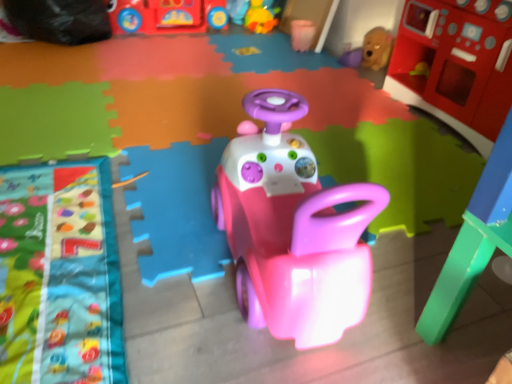
Locate an element on the screen. rubberized red play kitchen at upper right, marked as the 1th toy in a right-to-left arrangement is located at coordinates (456, 64).

At what (x,y) coordinates should I click in order to perform the action: click on shiny plastic bus at upper center, which is counted as the sixth toy, starting from the right. Please return your answer as a coordinate pair (x, y). The width and height of the screenshot is (512, 384). Looking at the image, I should click on (166, 16).

How much space does rubber duck at upper center, which appears as the second toy when viewed from the left, occupy horizontally?

It is 10.28 inches.

Locate an element on the screen. This screenshot has height=384, width=512. rubberized red play kitchen at upper right, marked as the 1th toy in a right-to-left arrangement is located at coordinates (456, 64).

Is rubber duck at upper center, the fifth toy positioned from the right, beside matte brown teddy bear at upper right, which is counted as the fifth toy, starting from the left?

No, rubber duck at upper center, the fifth toy positioned from the right, is not next to matte brown teddy bear at upper right, which is counted as the fifth toy, starting from the left.

Considering the relative sizes of rubber duck at upper center, the fifth toy positioned from the right, and matte brown teddy bear at upper right, acting as the 2th toy starting from the right, in the image provided, is rubber duck at upper center, the fifth toy positioned from the right, taller than matte brown teddy bear at upper right, acting as the 2th toy starting from the right,?

Correct, rubber duck at upper center, the fifth toy positioned from the right, is much taller as matte brown teddy bear at upper right, acting as the 2th toy starting from the right.

Which is correct: rubber duck at upper center, the fifth toy positioned from the right, is inside matte brown teddy bear at upper right, which is counted as the fifth toy, starting from the left, or outside of it?

rubber duck at upper center, the fifth toy positioned from the right, lies outside matte brown teddy bear at upper right, which is counted as the fifth toy, starting from the left.

From a real-world perspective, is pink plastic car at center, the fourth toy viewed from the right, physically above shiny plastic bus at upper center, which is counted as the sixth toy, starting from the right?

Yes, from a real-world perspective, pink plastic car at center, the fourth toy viewed from the right, is above shiny plastic bus at upper center, which is counted as the sixth toy, starting from the right.

What's the angular difference between pink plastic car at center, the fourth toy viewed from the right, and shiny plastic bus at upper center, which is counted as the sixth toy, starting from the right,'s facing directions?

The facing directions of pink plastic car at center, the fourth toy viewed from the right, and shiny plastic bus at upper center, which is counted as the sixth toy, starting from the right, are 94 degrees apart.

Based on the photo, between pink plastic car at center, positioned as the third toy in left-to-right order, and shiny plastic bus at upper center, marked as the 1th toy in a left-to-right arrangement, which one has smaller size?

With smaller size is pink plastic car at center, positioned as the third toy in left-to-right order.

Is pink plastic car at center, the fourth toy viewed from the right, facing away from shiny plastic bus at upper center, marked as the 1th toy in a left-to-right arrangement?

No, shiny plastic bus at upper center, marked as the 1th toy in a left-to-right arrangement, is not at the back of pink plastic car at center, the fourth toy viewed from the right.

Would you say rubberized red play kitchen at upper right, marked as the sixth toy in a left-to-right arrangement, is inside or outside rubber duck at upper center, the fifth toy positioned from the right?

rubberized red play kitchen at upper right, marked as the sixth toy in a left-to-right arrangement, is located beyond the bounds of rubber duck at upper center, the fifth toy positioned from the right.

Does rubberized red play kitchen at upper right, marked as the sixth toy in a left-to-right arrangement, have a smaller size compared to rubber duck at upper center, the fifth toy positioned from the right?

Actually, rubberized red play kitchen at upper right, marked as the sixth toy in a left-to-right arrangement, might be larger than rubber duck at upper center, the fifth toy positioned from the right.

From a real-world perspective, is rubberized red play kitchen at upper right, marked as the 1th toy in a right-to-left arrangement, above or below rubber duck at upper center, the fifth toy positioned from the right?

From a real-world perspective, rubberized red play kitchen at upper right, marked as the 1th toy in a right-to-left arrangement, is physically above rubber duck at upper center, the fifth toy positioned from the right.

Considering the sizes of objects rubberized red play kitchen at upper right, marked as the sixth toy in a left-to-right arrangement, and rubber duck at upper center, which appears as the second toy when viewed from the left, in the image provided, who is wider, rubberized red play kitchen at upper right, marked as the sixth toy in a left-to-right arrangement, or rubber duck at upper center, which appears as the second toy when viewed from the left,?

With larger width is rubberized red play kitchen at upper right, marked as the sixth toy in a left-to-right arrangement.

Between rubber duck at upper center, which appears as the second toy when viewed from the left, and shiny plastic bus at upper center, marked as the 1th toy in a left-to-right arrangement, which one appears on the right side from the viewer's perspective?

Positioned to the right is rubber duck at upper center, which appears as the second toy when viewed from the left.

Locate an element on the screen. The image size is (512, 384). the 1st toy in front of the rubber duck at upper center, the fifth toy positioned from the right, counting from the anchor's position is located at coordinates (166, 16).

Considering the sizes of objects rubber duck at upper center, which appears as the second toy when viewed from the left, and shiny plastic bus at upper center, marked as the 1th toy in a left-to-right arrangement, in the image provided, who is smaller, rubber duck at upper center, which appears as the second toy when viewed from the left, or shiny plastic bus at upper center, marked as the 1th toy in a left-to-right arrangement,?

rubber duck at upper center, which appears as the second toy when viewed from the left.

From a real-world perspective, is rubber duck at upper center, which appears as the second toy when viewed from the left, beneath shiny plastic bus at upper center, marked as the 1th toy in a left-to-right arrangement?

No.

From a real-world perspective, which is physically above, shiny plastic bus at upper center, which is counted as the sixth toy, starting from the right, or matte brown teddy bear at upper right, which is counted as the fifth toy, starting from the left?

In real-world perspective, shiny plastic bus at upper center, which is counted as the sixth toy, starting from the right, is above.

Does point (144, 9) appear closer or farther from the camera than point (369, 39)?

Point (144, 9) appears to be farther away from the viewer than point (369, 39).

Can you confirm if shiny plastic bus at upper center, marked as the 1th toy in a left-to-right arrangement, is positioned to the right of matte brown teddy bear at upper right, acting as the 2th toy starting from the right?

No.

Which of these two, shiny plastic bus at upper center, marked as the 1th toy in a left-to-right arrangement, or matte brown teddy bear at upper right, acting as the 2th toy starting from the right, stands shorter?

matte brown teddy bear at upper right, acting as the 2th toy starting from the right.

Is rubberized red play kitchen at upper right, marked as the sixth toy in a left-to-right arrangement, next to shiny plastic bus at upper center, which is counted as the sixth toy, starting from the right, and touching it?

There is a gap between rubberized red play kitchen at upper right, marked as the sixth toy in a left-to-right arrangement, and shiny plastic bus at upper center, which is counted as the sixth toy, starting from the right.

Can you confirm if rubberized red play kitchen at upper right, marked as the sixth toy in a left-to-right arrangement, is positioned to the left of shiny plastic bus at upper center, which is counted as the sixth toy, starting from the right?

Incorrect, rubberized red play kitchen at upper right, marked as the sixth toy in a left-to-right arrangement, is not on the left side of shiny plastic bus at upper center, which is counted as the sixth toy, starting from the right.

From the image's perspective, between rubberized red play kitchen at upper right, marked as the 1th toy in a right-to-left arrangement, and shiny plastic bus at upper center, which is counted as the sixth toy, starting from the right, which one is located above?

shiny plastic bus at upper center, which is counted as the sixth toy, starting from the right, from the image's perspective.

From a real-world perspective, does rubber duck at upper center, which appears as the second toy when viewed from the left, stand above pink plastic car at center, the fourth toy viewed from the right?

Actually, rubber duck at upper center, which appears as the second toy when viewed from the left, is physically below pink plastic car at center, the fourth toy viewed from the right, in the real world.

What are the coordinates of `the 5th toy in front of the rubber duck at upper center, the fifth toy positioned from the right, starting your count from the anchor` in the screenshot? It's located at (292, 229).

Does rubber duck at upper center, which appears as the second toy when viewed from the left, appear on the right side of pink plastic car at center, positioned as the third toy in left-to-right order?

No.

Locate an element on the screen. The width and height of the screenshot is (512, 384). the 3rd toy counting from the right side of the rubber duck at upper center, which appears as the second toy when viewed from the left is located at coordinates (376, 48).

This screenshot has height=384, width=512. Identify the location of the 5th toy below when counting from the shiny plastic bus at upper center, which is counted as the sixth toy, starting from the right (from the image's perspective). (292, 229).

Based on the photo, which object lies nearer to the anchor point shiny plastic bus at upper center, marked as the 1th toy in a left-to-right arrangement, rubberized red play kitchen at upper right, marked as the sixth toy in a left-to-right arrangement, or matte brown teddy bear at upper right, which is counted as the fifth toy, starting from the left?

matte brown teddy bear at upper right, which is counted as the fifth toy, starting from the left, is closer to shiny plastic bus at upper center, marked as the 1th toy in a left-to-right arrangement.

Which object lies further to the anchor point shiny plastic bus at upper center, marked as the 1th toy in a left-to-right arrangement, matte brown teddy bear at upper right, acting as the 2th toy starting from the right, or rubber duck at upper center, the fifth toy positioned from the right?

Among the two, matte brown teddy bear at upper right, acting as the 2th toy starting from the right, is located further to shiny plastic bus at upper center, marked as the 1th toy in a left-to-right arrangement.

When comparing their distances from rubber duck at upper center, the fifth toy positioned from the right, does shiny plastic bus at upper center, marked as the 1th toy in a left-to-right arrangement, or rubberized red play kitchen at upper right, marked as the sixth toy in a left-to-right arrangement, seem further?

Among the two, rubberized red play kitchen at upper right, marked as the sixth toy in a left-to-right arrangement, is located further to rubber duck at upper center, the fifth toy positioned from the right.

In the scene shown: Considering their positions, is pink plastic car at center, the fourth toy viewed from the right, positioned further to pink plastic cup at upper center, acting as the 4th toy starting from the left, than matte brown teddy bear at upper right, acting as the 2th toy starting from the right?

pink plastic car at center, the fourth toy viewed from the right.

Which object lies further to the anchor point matte brown teddy bear at upper right, acting as the 2th toy starting from the right, pink plastic car at center, positioned as the third toy in left-to-right order, or rubberized red play kitchen at upper right, marked as the 1th toy in a right-to-left arrangement?

pink plastic car at center, positioned as the third toy in left-to-right order, is further to matte brown teddy bear at upper right, acting as the 2th toy starting from the right.

Which object lies further to the anchor point rubber duck at upper center, which appears as the second toy when viewed from the left, rubberized red play kitchen at upper right, marked as the 1th toy in a right-to-left arrangement, or shiny plastic bus at upper center, which is counted as the sixth toy, starting from the right?

The object further to rubber duck at upper center, which appears as the second toy when viewed from the left, is rubberized red play kitchen at upper right, marked as the 1th toy in a right-to-left arrangement.

Based on their spatial positions, is matte brown teddy bear at upper right, which is counted as the fifth toy, starting from the left, or rubberized red play kitchen at upper right, marked as the sixth toy in a left-to-right arrangement, further from pink plastic car at center, the fourth toy viewed from the right?

matte brown teddy bear at upper right, which is counted as the fifth toy, starting from the left, is further to pink plastic car at center, the fourth toy viewed from the right.

From the picture: From the image, which object appears to be nearer to matte brown teddy bear at upper right, which is counted as the fifth toy, starting from the left, shiny plastic bus at upper center, which is counted as the sixth toy, starting from the right, or pink plastic cup at upper center, acting as the 4th toy starting from the left?

Among the two, pink plastic cup at upper center, acting as the 4th toy starting from the left, is located nearer to matte brown teddy bear at upper right, which is counted as the fifth toy, starting from the left.

Where is `toy between pink plastic car at center, positioned as the third toy in left-to-right order, and matte brown teddy bear at upper right, which is counted as the fifth toy, starting from the left, along the z-axis`? This screenshot has width=512, height=384. toy between pink plastic car at center, positioned as the third toy in left-to-right order, and matte brown teddy bear at upper right, which is counted as the fifth toy, starting from the left, along the z-axis is located at coordinates (456, 64).

What are the coordinates of `toy positioned between rubberized red play kitchen at upper right, marked as the 1th toy in a right-to-left arrangement, and pink plastic cup at upper center, acting as the 4th toy starting from the left, from near to far` in the screenshot? It's located at point(376,48).